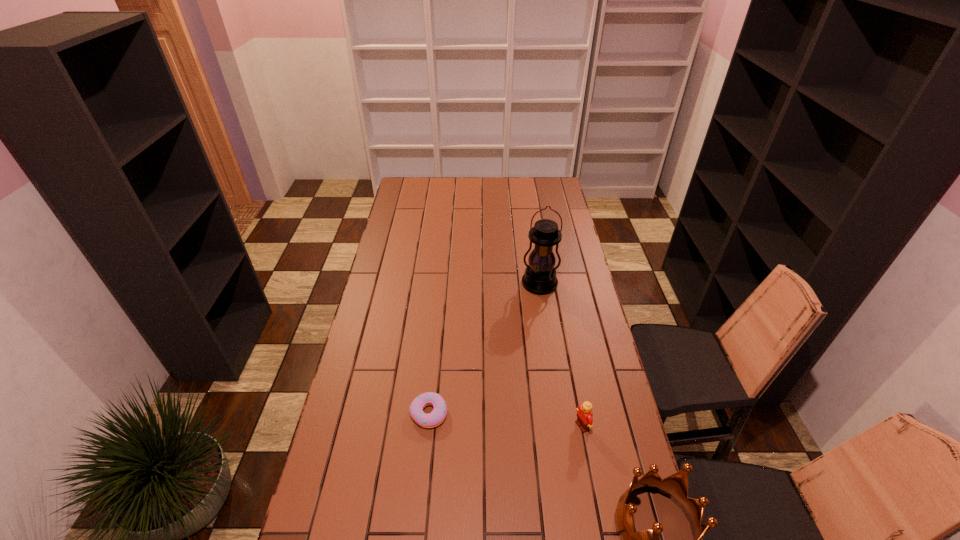
Image resolution: width=960 pixels, height=540 pixels. I want to click on doughnut, so click(437, 416).

At what (x,y) coordinates should I click in order to perform the action: click on the leftmost object. Please return your answer as a coordinate pair (x, y). Looking at the image, I should click on (437, 416).

This screenshot has height=540, width=960. In order to click on the tallest object in this screenshot , I will do `click(540, 278)`.

This screenshot has height=540, width=960. Find the location of `lantern`. lantern is located at coordinates (x=540, y=278).

I want to click on the second shortest object, so click(x=584, y=420).

The image size is (960, 540). I want to click on blank space located on the back of the leftmost object, so click(x=437, y=330).

Identify some points within the free space located above the lantern, indicating its light source. Please provide its 2D coordinates. Your answer should be formatted as a tuple, i.e. [(x, y)], where the tuple contains the x and y coordinates of a point satisfying the conditions above.

[(537, 342)]

Find a few locations in the blank space located above the lantern, indicating its light source. Please provide its 2D coordinates. Your answer should be formatted as a tuple, i.e. [(x, y)], where the tuple contains the x and y coordinates of a point satisfying the conditions above.

[(538, 330)]

Locate several spots in the free space located 0.270m above the lantern, indicating its light source. Please provide its 2D coordinates. Your answer should be formatted as a tuple, i.e. [(x, y)], where the tuple contains the x and y coordinates of a point satisfying the conditions above.

[(537, 348)]

The height and width of the screenshot is (540, 960). Find the location of `vacant space located on the face of the third tallest object`. vacant space located on the face of the third tallest object is located at coordinates (555, 441).